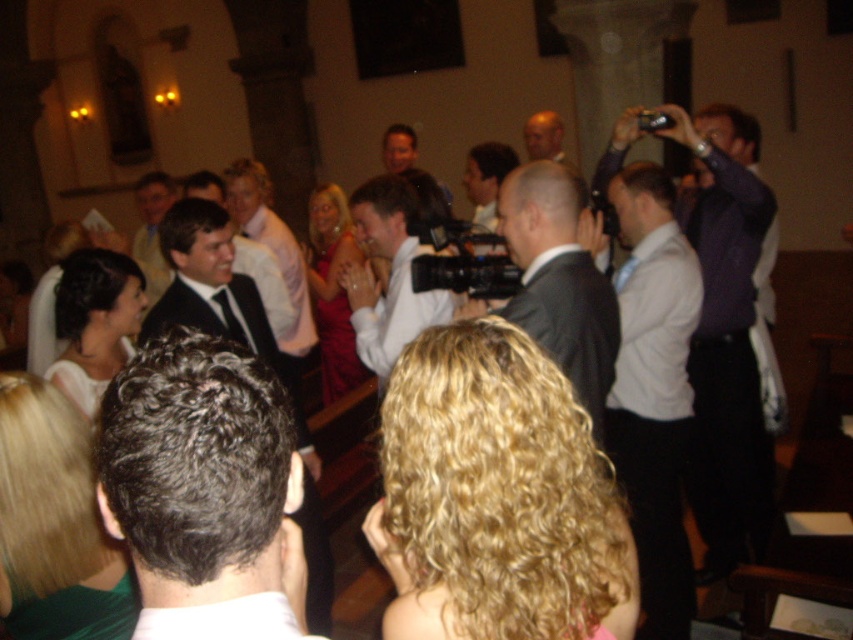
Between white satin dress at center and white satin suit at center, which one appears on the left side from the viewer's perspective?

Positioned to the left is white satin dress at center.

The image size is (853, 640). Describe the element at coordinates (94, 323) in the screenshot. I see `white satin dress at center` at that location.

Where is `white satin dress at center`? Image resolution: width=853 pixels, height=640 pixels. white satin dress at center is located at coordinates (94, 323).

Identify the location of white satin dress at center. This screenshot has height=640, width=853. (94, 323).

The width and height of the screenshot is (853, 640). Find the location of `white glossy camera at center`. white glossy camera at center is located at coordinates (387, 275).

Is point (422, 317) farther from camera compared to point (241, 173)?

No, it is not.

You are a GUI agent. You are given a task and a screenshot of the screen. Output one action in this format:
    pyautogui.click(x=<x>, y=<y>)
    Task: Click on the white glossy camera at center
    The width and height of the screenshot is (853, 640).
    Given the screenshot: What is the action you would take?
    pyautogui.click(x=387, y=275)

Can you confirm if white glossy camera at center is positioned above smooth bald head at center?

Incorrect, white glossy camera at center is not positioned above smooth bald head at center.

Who is taller, white glossy camera at center or smooth bald head at center?

Standing taller between the two is white glossy camera at center.

Who is more forward, (395, 291) or (531, 125)?

Point (395, 291) is more forward.

Locate an element on the screen. This screenshot has width=853, height=640. white glossy camera at center is located at coordinates (387, 275).